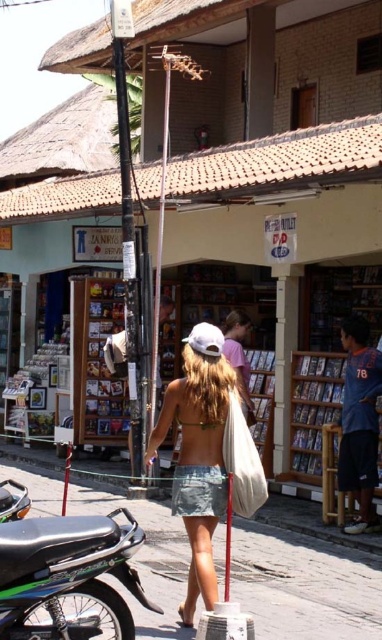
Question: Which of these objects is positioned farthest from the pink fabric shirt at center?

Choices:
 (A) smooth concrete pavement at center
 (B) green matte motorcycle at lower left
 (C) denim skirt at center
 (D) blue fabric shirt at center

Answer: (B)

Question: Which point is farther to the camera?

Choices:
 (A) (1, 512)
 (B) (349, 362)
 (C) (242, 314)
 (D) (98, 580)

Answer: (C)

Question: Does denim skirt at center lie in front of shiny black motorcycle at lower left?

Choices:
 (A) yes
 (B) no

Answer: (A)

Question: Does blue fabric shirt at center lie in front of shiny black motorcycle at lower left?

Choices:
 (A) yes
 (B) no

Answer: (B)

Question: Can you confirm if green matte motorcycle at lower left is smaller than shiny black motorcycle at lower left?

Choices:
 (A) no
 (B) yes

Answer: (A)

Question: Which object is the farthest from the green matte motorcycle at lower left?

Choices:
 (A) smooth concrete pavement at center
 (B) denim skirt at center
 (C) blue fabric shirt at center
 (D) pink fabric shirt at center

Answer: (C)